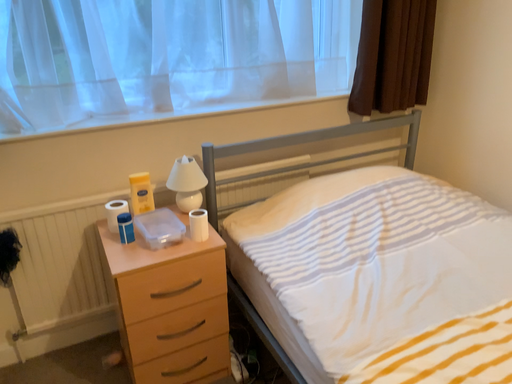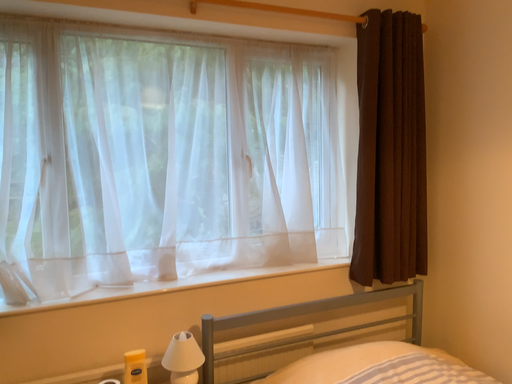
Question: How did the camera likely rotate when shooting the video?

Choices:
 (A) rotated downward
 (B) rotated upward

Answer: (B)